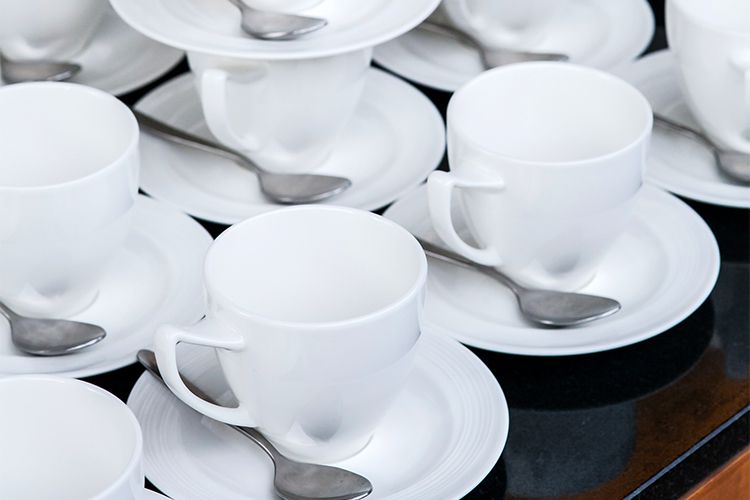
Identify the location of mugs. (70, 173), (310, 91), (559, 187), (310, 331), (111, 427), (711, 70), (498, 26), (58, 35).